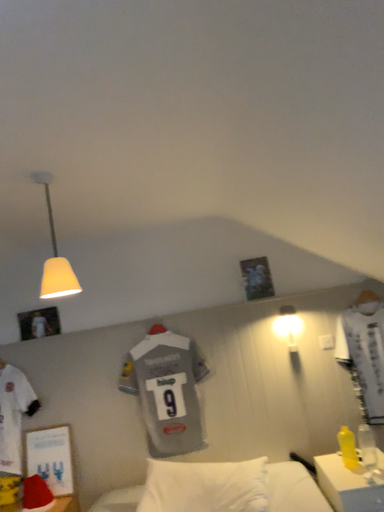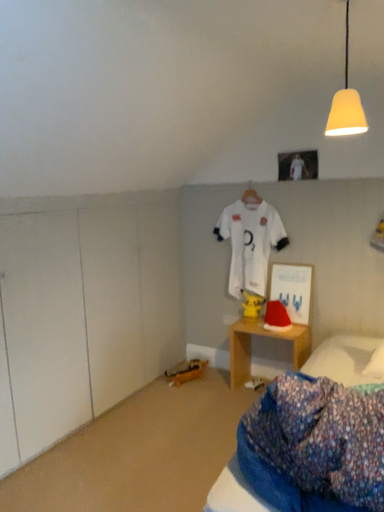
Question: How did the camera likely rotate when shooting the video?

Choices:
 (A) rotated right
 (B) rotated left

Answer: (B)